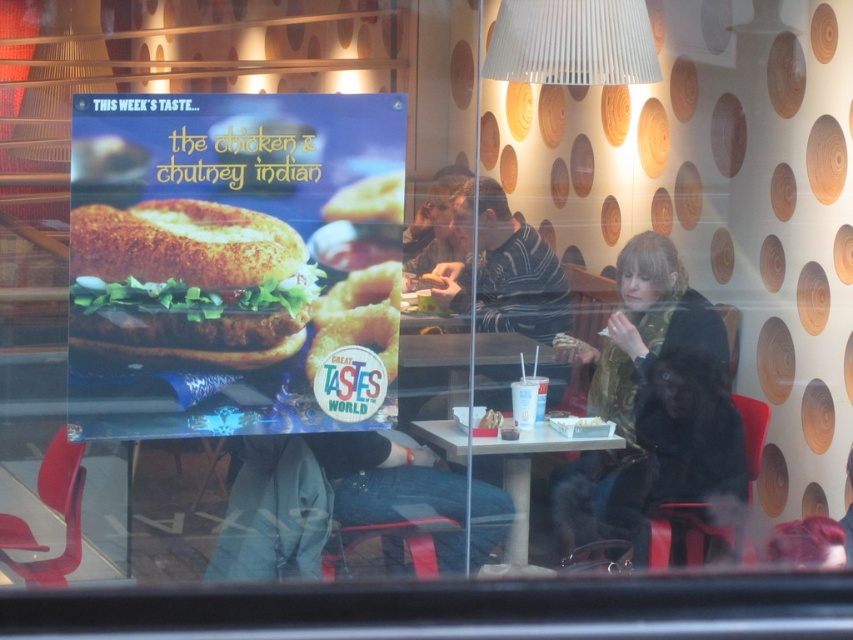
Does green wool scarf at center have a greater width compared to breaded golden-brown hamburger at center?

Incorrect, green wool scarf at center's width does not surpass breaded golden-brown hamburger at center's.

In the scene shown: Is green wool scarf at center bigger than breaded golden-brown hamburger at center?

Correct, green wool scarf at center is larger in size than breaded golden-brown hamburger at center.

Which is behind, point (666, 280) or point (100, 323)?

The point (666, 280) is more distant.

You are a GUI agent. You are given a task and a screenshot of the screen. Output one action in this format:
    pyautogui.click(x=<x>, y=<y>)
    Task: Click on the green wool scarf at center
    The width and height of the screenshot is (853, 640).
    Given the screenshot: What is the action you would take?
    pyautogui.click(x=654, y=404)

Is point (659, 276) behind point (460, 288)?

No, (659, 276) is in front of (460, 288).

Which is behind, point (666, 451) or point (462, 308)?

Point (462, 308)

Locate an element on the screen. Image resolution: width=853 pixels, height=640 pixels. green wool scarf at center is located at coordinates (654, 404).

Where is `breaded golden-brown hamburger at center`? This screenshot has width=853, height=640. breaded golden-brown hamburger at center is located at coordinates (189, 282).

In the scene shown: Which is above, breaded golden-brown hamburger at center or striped sweater at center?

striped sweater at center is above.

Identify the location of breaded golden-brown hamburger at center. (189, 282).